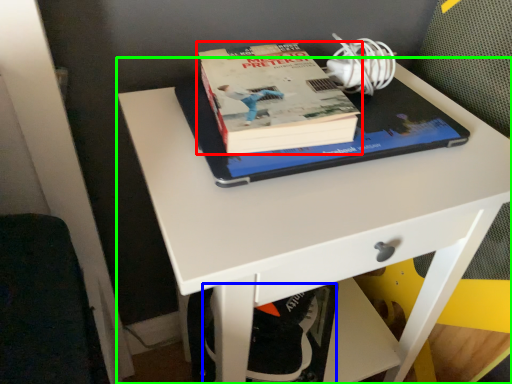
Question: Which object is positioned farthest from book (highlighted by a red box)? Select from swivel chair (highlighted by a blue box) and desk (highlighted by a green box).

Choices:
 (A) swivel chair
 (B) desk

Answer: (A)